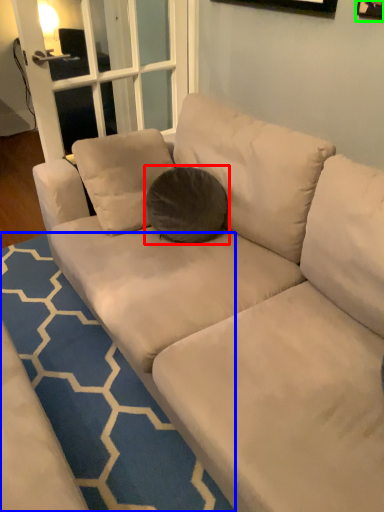
Question: Which object is positioned farthest from throw pillow (highlighted by a red box)? Select from doormat (highlighted by a blue box) and picture frame (highlighted by a green box).

Choices:
 (A) doormat
 (B) picture frame

Answer: (B)